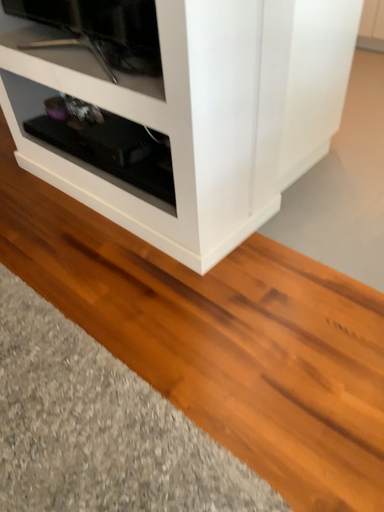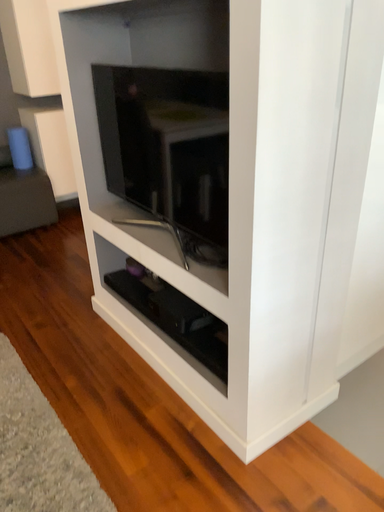
Question: How did the camera likely rotate when shooting the video?

Choices:
 (A) rotated right
 (B) rotated left

Answer: (B)